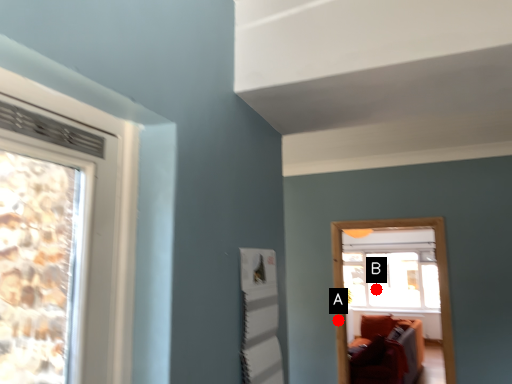
Question: Two points are circled on the image, labeled by A and B beside each circle. Among these points, which one is nearest to the camera?

Choices:
 (A) A is closer
 (B) B is closer

Answer: (A)